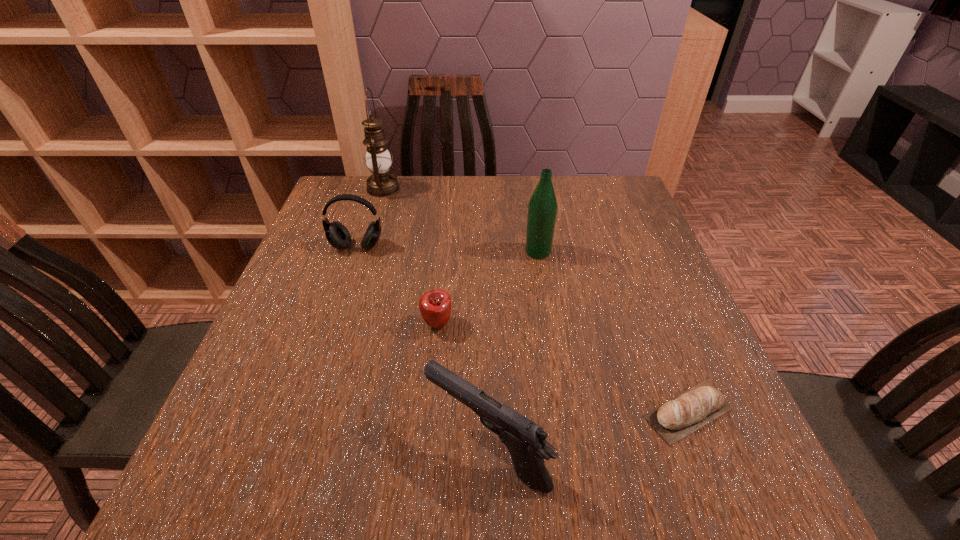
Image resolution: width=960 pixels, height=540 pixels. In order to click on oil lamp present at the left edge in this screenshot , I will do `click(381, 183)`.

Where is `headset positioned at the left edge`? The image size is (960, 540). headset positioned at the left edge is located at coordinates (337, 234).

Where is `object situated at the right edge`? Image resolution: width=960 pixels, height=540 pixels. object situated at the right edge is located at coordinates (675, 419).

In order to click on object that is at the far left corner in this screenshot , I will do `click(381, 183)`.

Where is `free region at the far edge of the desktop`? free region at the far edge of the desktop is located at coordinates (552, 178).

I want to click on vacant space at the near edge of the desktop, so point(424,500).

The height and width of the screenshot is (540, 960). I want to click on vacant space at the left edge of the desktop, so click(306, 251).

Find the location of a particular element. The width and height of the screenshot is (960, 540). vacant space at the right edge is located at coordinates (678, 297).

Identify the location of vacant area at the far left corner of the desktop. The width and height of the screenshot is (960, 540). (368, 219).

Locate an element on the screen. free spot at the far right corner of the desktop is located at coordinates (606, 200).